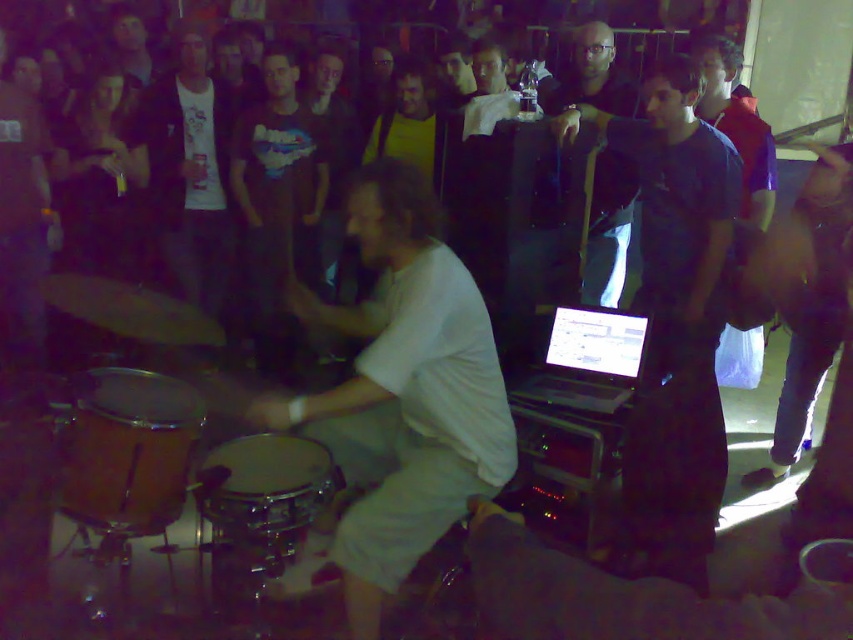
Who is positioned more to the right, wooden drum at center or black matte jacket at upper center?

Positioned to the right is black matte jacket at upper center.

Measure the distance from wooden drum at center to black matte jacket at upper center.

The distance of wooden drum at center from black matte jacket at upper center is 5.82 feet.

What do you see at coordinates (128, 449) in the screenshot?
I see `wooden drum at center` at bounding box center [128, 449].

At what (x,y) coordinates should I click in order to perform the action: click on wooden drum at center. Please return your answer as a coordinate pair (x, y). This screenshot has height=640, width=853. Looking at the image, I should click on click(x=128, y=449).

Between dark blue t-shirt at center and black matte jacket at upper center, which one has more height?

dark blue t-shirt at center is taller.

Is dark blue t-shirt at center to the left of black matte jacket at upper center from the viewer's perspective?

No, dark blue t-shirt at center is not to the left of black matte jacket at upper center.

Between point (672, 125) and point (589, 68), which one is positioned behind?

Point (589, 68)

Where is `dark blue t-shirt at center`? The width and height of the screenshot is (853, 640). dark blue t-shirt at center is located at coordinates (674, 323).

Can you confirm if white t-shirt at center is smaller than black matte jacket at upper center?

Actually, white t-shirt at center might be larger than black matte jacket at upper center.

Which is below, white t-shirt at center or black matte jacket at upper center?

black matte jacket at upper center is below.

Find the location of a particular element. Image resolution: width=853 pixels, height=640 pixels. white t-shirt at center is located at coordinates (189, 172).